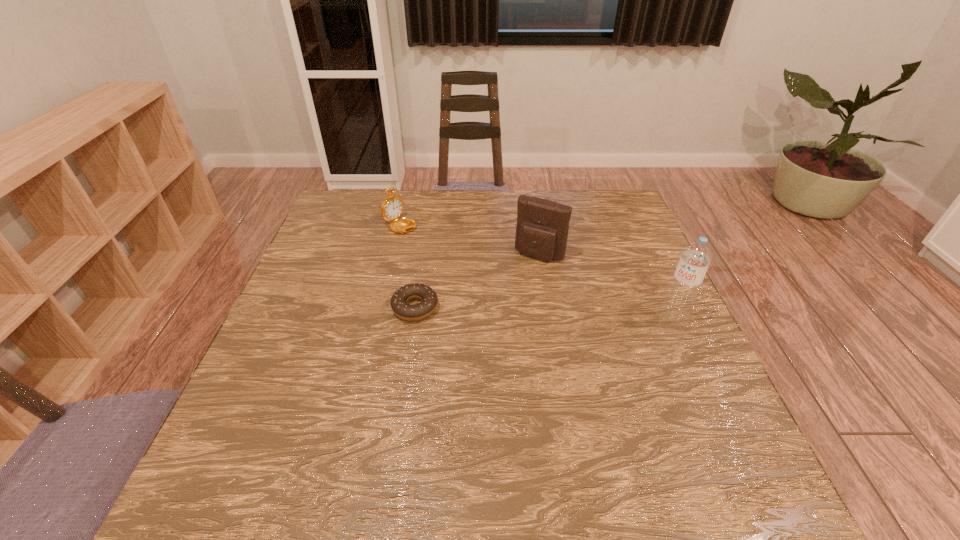
Image resolution: width=960 pixels, height=540 pixels. I want to click on blank space at the right edge, so click(681, 399).

At what (x,y) coordinates should I click in order to perform the action: click on free space at the far left corner of the desktop. Please return your answer as a coordinate pair (x, y). Looking at the image, I should click on (367, 228).

In the image, there is a desktop. Where is `vacant space at the near right corner`? vacant space at the near right corner is located at coordinates (658, 439).

Image resolution: width=960 pixels, height=540 pixels. What are the coordinates of `unoccupied position between the third shortest object and the tallest object` in the screenshot? It's located at (607, 285).

At what (x,y) coordinates should I click in order to perform the action: click on vacant space in between the pocket watch and the second farthest object. Please return your answer as a coordinate pair (x, y). Image resolution: width=960 pixels, height=540 pixels. Looking at the image, I should click on click(473, 238).

At what (x,y) coordinates should I click in order to perform the action: click on vacant region between the rightmost object and the shortest object. Please return your answer as a coordinate pair (x, y). Looking at the image, I should click on (544, 312).

Locate an element on the screen. The width and height of the screenshot is (960, 540). vacant region between the third tallest object and the second tallest object is located at coordinates (473, 238).

What are the coordinates of `vacant space in between the tallest object and the third tallest object` in the screenshot? It's located at (540, 268).

Locate an element on the screen. This screenshot has height=540, width=960. free space that is in between the second shortest object and the doughnut is located at coordinates (411, 264).

This screenshot has width=960, height=540. I want to click on free space between the tallest object and the shortest object, so click(x=544, y=312).